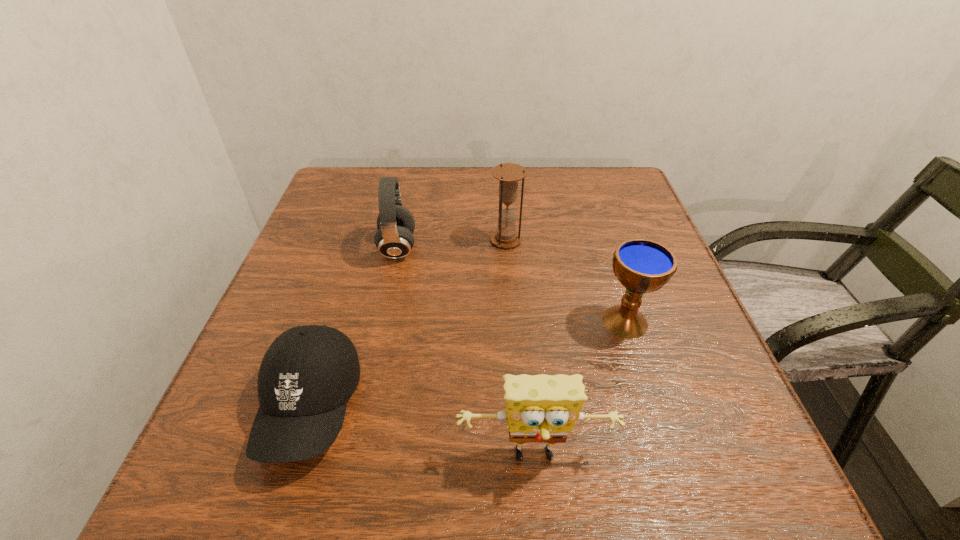
Locate which object ranks in proximity to the headset. Please provide its 2D coordinates. Your answer should be formatted as a tuple, i.e. [(x, y)], where the tuple contains the x and y coordinates of a point satisfying the conditions above.

[(508, 174)]

Identify which object is located as the fourth nearest to the headset. Please provide its 2D coordinates. Your answer should be formatted as a tuple, i.e. [(x, y)], where the tuple contains the x and y coordinates of a point satisfying the conditions above.

[(542, 408)]

Identify the location of vacant area in the image that satisfies the following two spatial constraints: 1. on the ear cups of the headset; 2. on the left side of the rightmost object. (382, 321).

Identify the location of vacant point that satisfies the following two spatial constraints: 1. on the ear cups of the headset; 2. on the right side of the rightmost object. (382, 321).

Locate an element on the screen. The image size is (960, 540). vacant space that satisfies the following two spatial constraints: 1. on the front side of the hourglass; 2. on the ear cups of the headset is located at coordinates (507, 248).

The width and height of the screenshot is (960, 540). In order to click on free region that satisfies the following two spatial constraints: 1. on the ear cups of the headset; 2. on the right side of the chalice in this screenshot , I will do `click(382, 321)`.

The width and height of the screenshot is (960, 540). I want to click on free space that satisfies the following two spatial constraints: 1. on the ear cups of the headset; 2. on the front-facing side of the shortest object, so click(x=364, y=407).